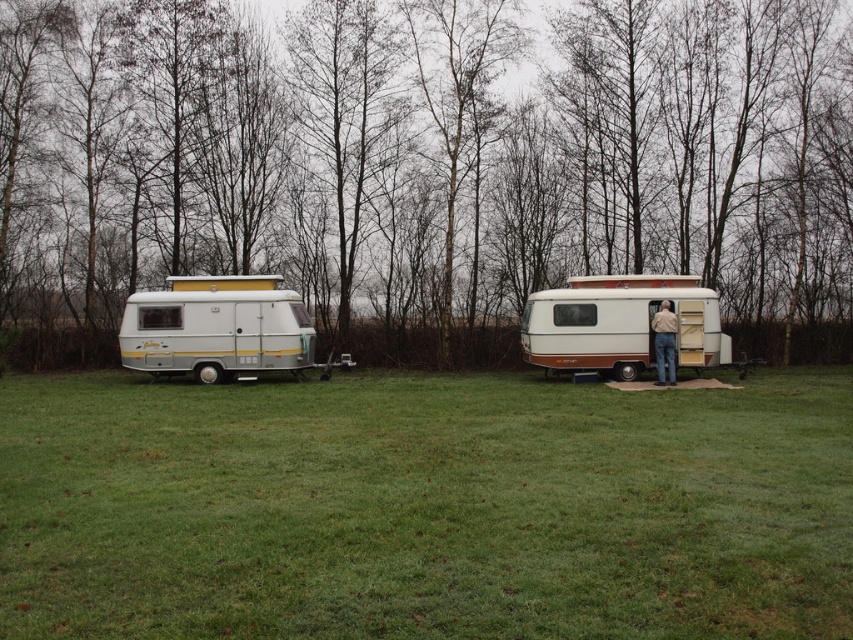
Who is positioned more to the right, green grass at center or silver metallic camper at left?

green grass at center is more to the right.

Between point (787, 620) and point (306, 346), which one is positioned in front?

Point (787, 620) is more forward.

What are the coordinates of `green grass at center` in the screenshot? It's located at (424, 508).

Where is `green grass at center`? The image size is (853, 640). green grass at center is located at coordinates (424, 508).

Is point (552, 292) positioned before point (665, 358)?

No, (552, 292) is further to viewer.

Can you confirm if brown textured caravan at center is positioned to the right of brown leather jacket at center?

No, brown textured caravan at center is not to the right of brown leather jacket at center.

What do you see at coordinates (619, 324) in the screenshot?
I see `brown textured caravan at center` at bounding box center [619, 324].

You are a GUI agent. You are given a task and a screenshot of the screen. Output one action in this format:
    pyautogui.click(x=<x>, y=<y>)
    Task: Click on the brown textured caravan at center
    This screenshot has height=640, width=853.
    Given the screenshot: What is the action you would take?
    [x=619, y=324]

Which is above, green grass at center or brown leather jacket at center?

Positioned higher is brown leather jacket at center.

Between point (563, 406) and point (670, 346), which one is positioned behind?

Point (670, 346)

Find the location of `green grass at center`. green grass at center is located at coordinates (424, 508).